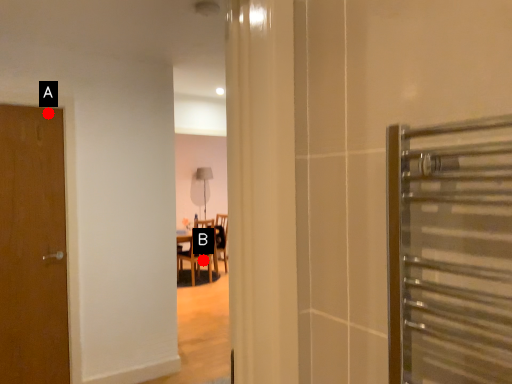
Question: Two points are circled on the image, labeled by A and B beside each circle. Which point is farther to the camera?

Choices:
 (A) A is further
 (B) B is further

Answer: (B)